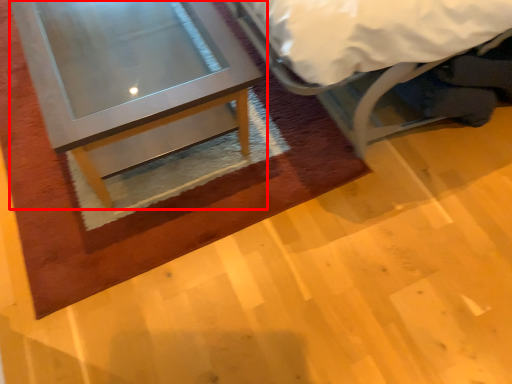
Question: From the image, what is the correct spatial relationship of table (annotated by the red box) in relation to bed?

Choices:
 (A) left
 (B) right

Answer: (A)